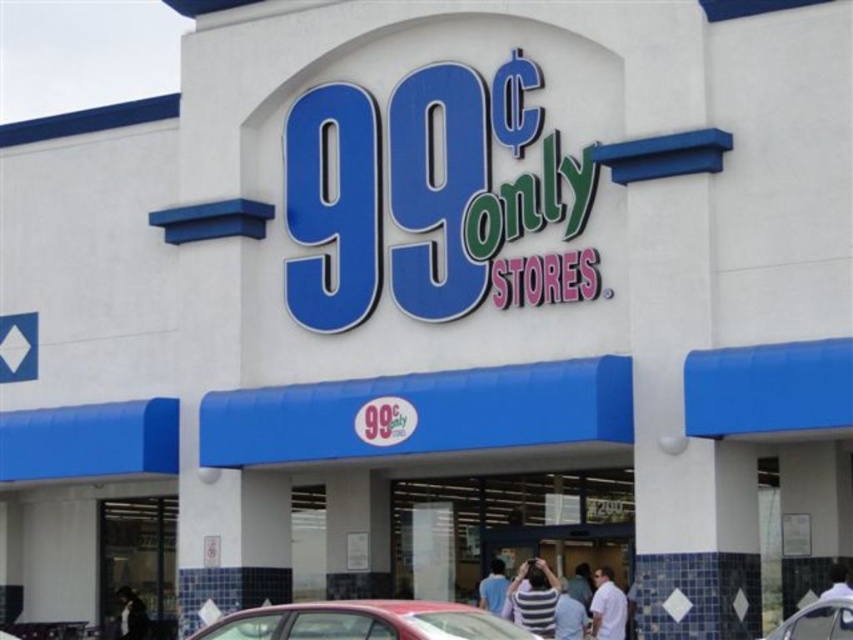
Does metallic red car at lower center appear on the left side of dark blue shirt at lower left?

No, metallic red car at lower center is not to the left of dark blue shirt at lower left.

Image resolution: width=853 pixels, height=640 pixels. What do you see at coordinates (363, 621) in the screenshot?
I see `metallic red car at lower center` at bounding box center [363, 621].

Describe the element at coordinates (363, 621) in the screenshot. This screenshot has height=640, width=853. I see `metallic red car at lower center` at that location.

At what (x,y) coordinates should I click in order to perform the action: click on metallic red car at lower center. Please return your answer as a coordinate pair (x, y). The width and height of the screenshot is (853, 640). Looking at the image, I should click on (363, 621).

Can you confirm if metallic red car at lower center is wider than striped shirt at center?

Correct, the width of metallic red car at lower center exceeds that of striped shirt at center.

Who is lower down, metallic red car at lower center or striped shirt at center?

Positioned lower is striped shirt at center.

Is point (486, 636) farther from camera compared to point (584, 611)?

No, (486, 636) is closer to viewer.

The image size is (853, 640). Find the location of `metallic red car at lower center`. metallic red car at lower center is located at coordinates [363, 621].

Between metallic red car at lower center and blue shirt at center, which one is positioned lower?

Positioned lower is blue shirt at center.

Is metallic red car at lower center shorter than blue shirt at center?

No, metallic red car at lower center is not shorter than blue shirt at center.

I want to click on metallic red car at lower center, so click(363, 621).

I want to click on metallic red car at lower center, so click(363, 621).